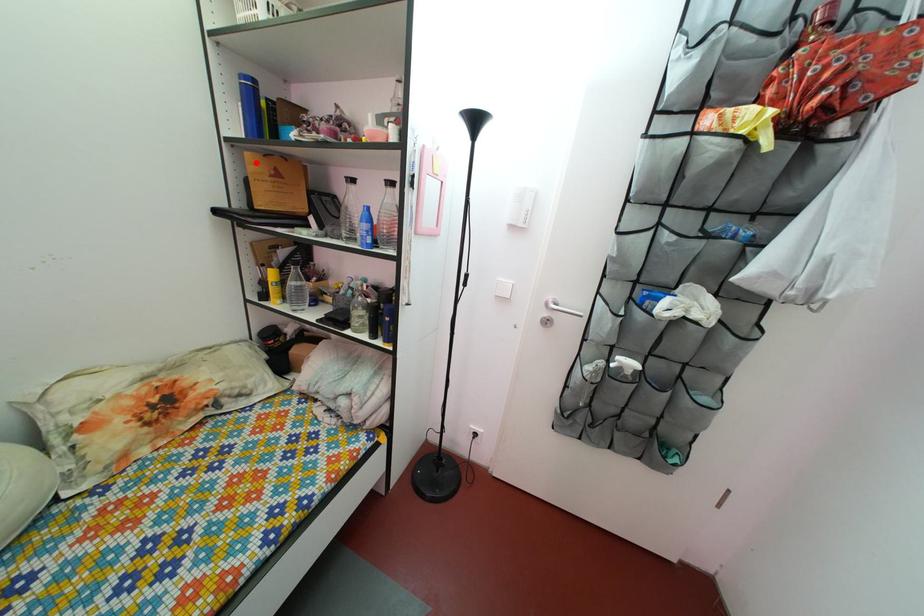
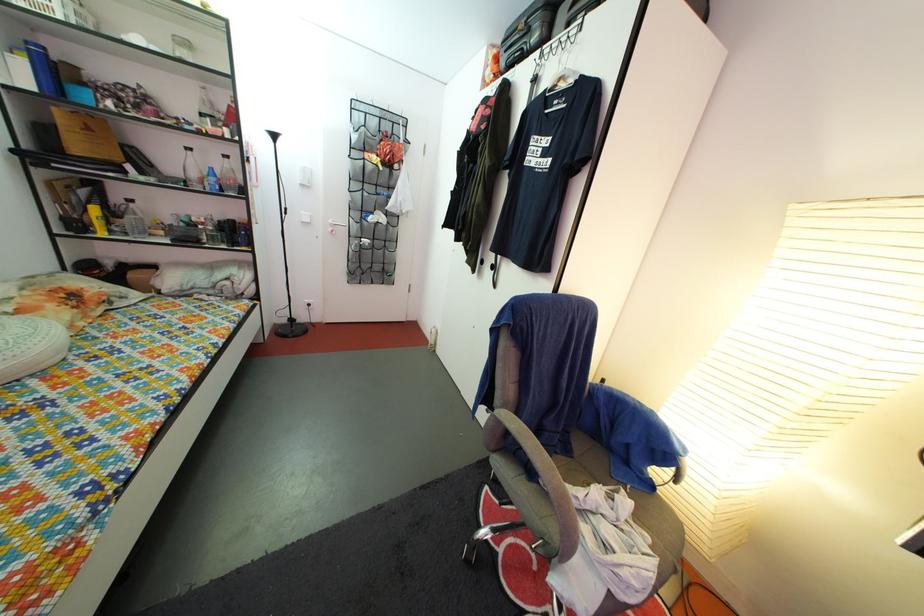
Question: I am providing you with two images of the same scene from different viewpoints. A red point is marked on the first image. At the location where the point appears in image 1, is it still visible in image 2?

Choices:
 (A) Yes
 (B) No

Answer: (A)